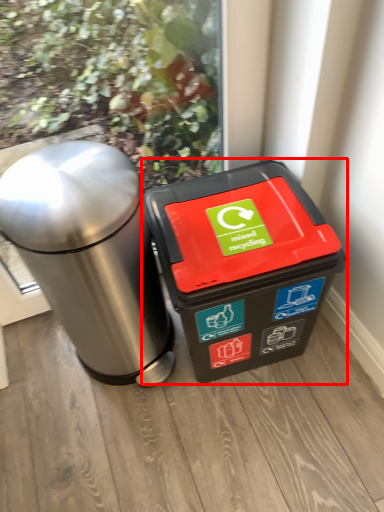
Question: From the image's perspective, what is the correct spatial positioning of waste container (annotated by the red box) in reference to waste container?

Choices:
 (A) below
 (B) above

Answer: (A)